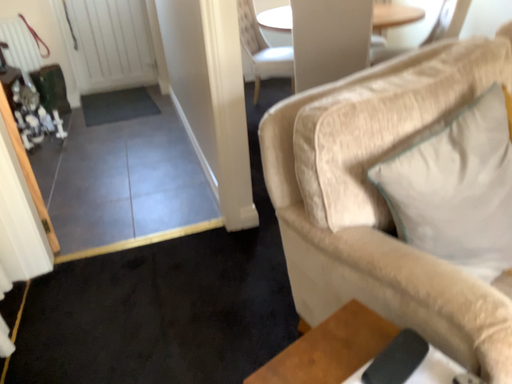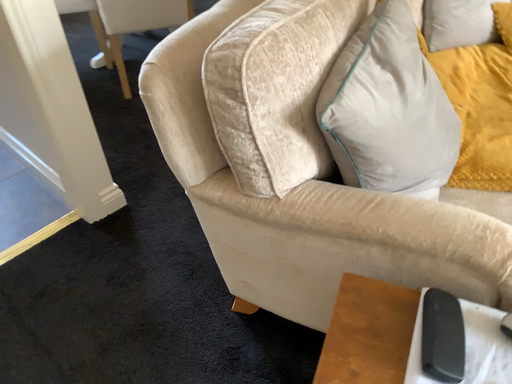
Question: Which way did the camera rotate in the video?

Choices:
 (A) rotated right
 (B) rotated left

Answer: (A)